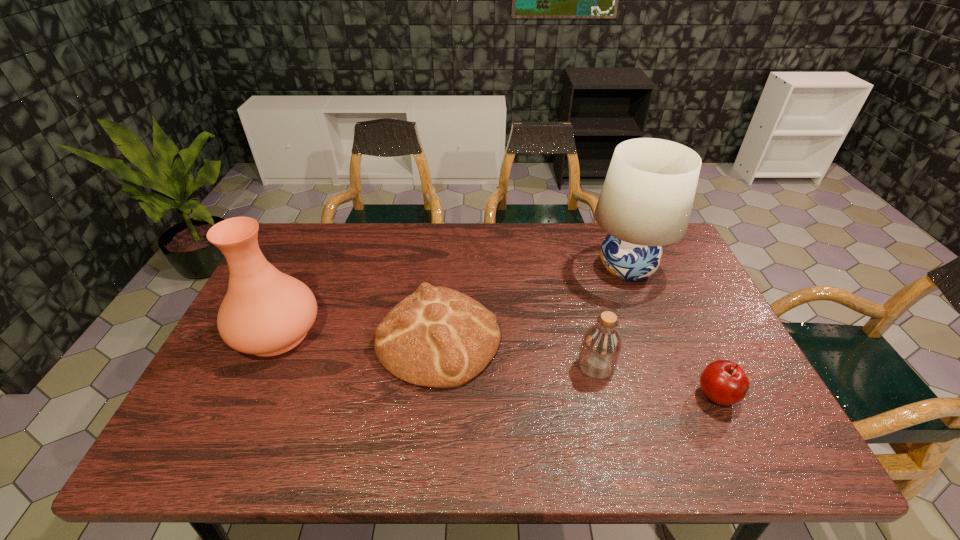
The width and height of the screenshot is (960, 540). What are the coordinates of `vacant space located on the right of the bread` in the screenshot? It's located at (638, 338).

Find the location of a particular element. The image size is (960, 540). vacant position located 0.130m on the left of the apple is located at coordinates (640, 395).

In order to click on object at the far edge in this screenshot , I will do `click(646, 200)`.

Find the location of a particular element. The width and height of the screenshot is (960, 540). object that is at the left edge is located at coordinates (265, 312).

Locate an element on the screen. The width and height of the screenshot is (960, 540). lampshade at the right edge is located at coordinates (646, 200).

In order to click on apple at the right edge in this screenshot , I will do `click(723, 382)`.

Identify the location of object that is at the far right corner. (646, 200).

In the image, there is a desktop. What are the coordinates of `vacant space at the far edge` in the screenshot? It's located at (431, 257).

Where is `free spot at the near edge of the desktop`? Image resolution: width=960 pixels, height=540 pixels. free spot at the near edge of the desktop is located at coordinates (376, 431).

Find the location of `vacant space at the left edge of the desktop`. vacant space at the left edge of the desktop is located at coordinates (238, 366).